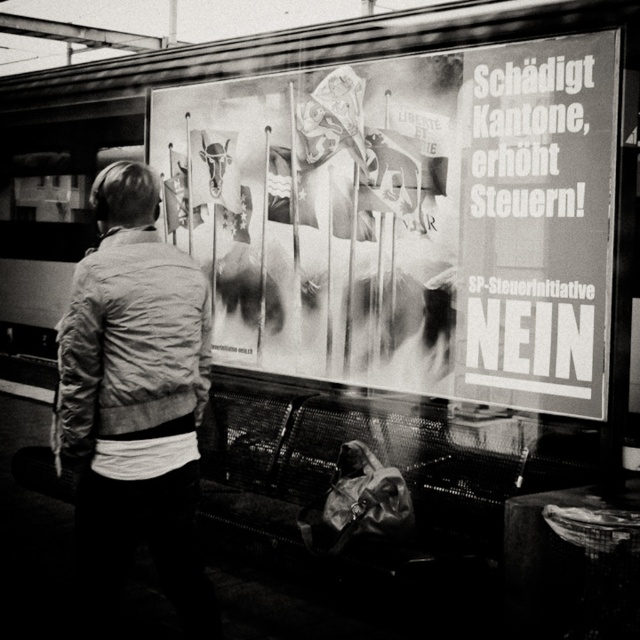
Is black paper poster at center above light gray jacket at center?

Indeed, black paper poster at center is positioned over light gray jacket at center.

Find the location of a particular element. The width and height of the screenshot is (640, 640). black paper poster at center is located at coordinates (406, 220).

You are a GUI agent. You are given a task and a screenshot of the screen. Output one action in this format:
    pyautogui.click(x=<x>, y=<y>)
    Task: Click on the black paper poster at center
    
    Given the screenshot: What is the action you would take?
    pyautogui.click(x=406, y=220)